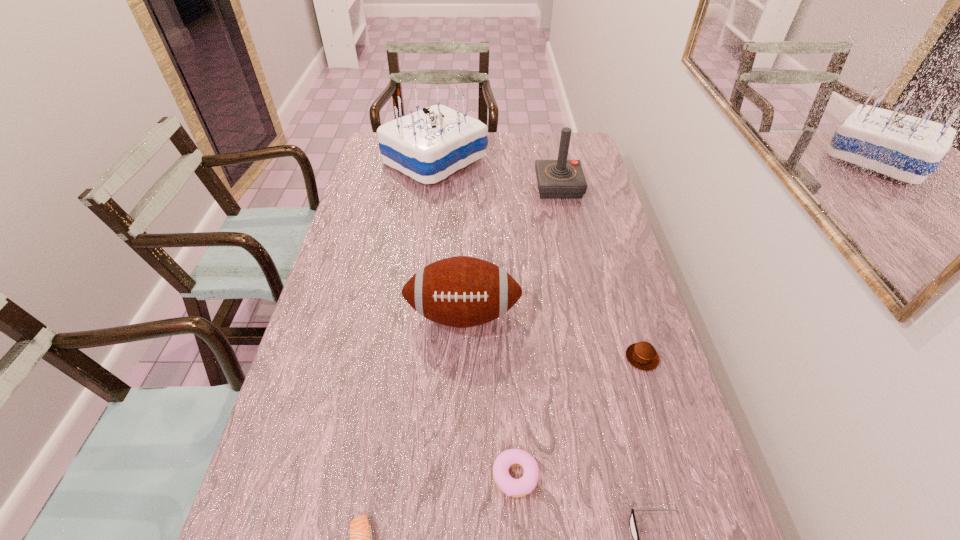
Image resolution: width=960 pixels, height=540 pixels. In order to click on vacant position located 0.300m on the rectangular base of the second tallest object in this screenshot , I will do `click(454, 186)`.

What are the coordinates of `vacant region located on the laces of the football` in the screenshot? It's located at (460, 411).

The height and width of the screenshot is (540, 960). What are the coordinates of `free space located on the back of the fourth shortest object` in the screenshot? It's located at (612, 258).

In order to click on free region located on the right of the doughnut in this screenshot , I will do `click(660, 476)`.

Where is `object that is positioned at the far edge`? This screenshot has height=540, width=960. object that is positioned at the far edge is located at coordinates (428, 145).

This screenshot has height=540, width=960. I want to click on object that is at the left edge, so click(428, 145).

What are the coordinates of `joystick that is at the right edge` in the screenshot? It's located at (557, 179).

Where is `muffin present at the right edge`? This screenshot has width=960, height=540. muffin present at the right edge is located at coordinates (642, 355).

Identify the location of object that is positioned at the far left corner. This screenshot has width=960, height=540. 428,145.

The height and width of the screenshot is (540, 960). I want to click on vacant space at the far edge of the desktop, so click(x=492, y=139).